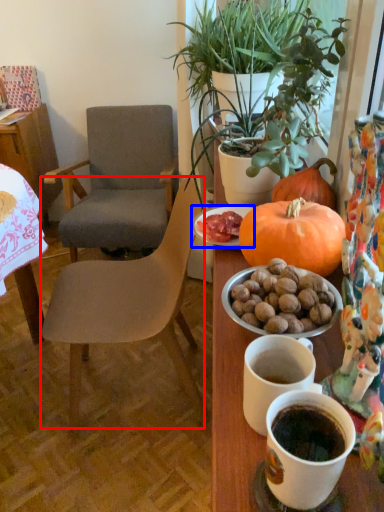
Question: Among these objects, which one is nearest to the camera, chair (highlighted by a red box) or plate (highlighted by a blue box)?

Choices:
 (A) chair
 (B) plate

Answer: (B)